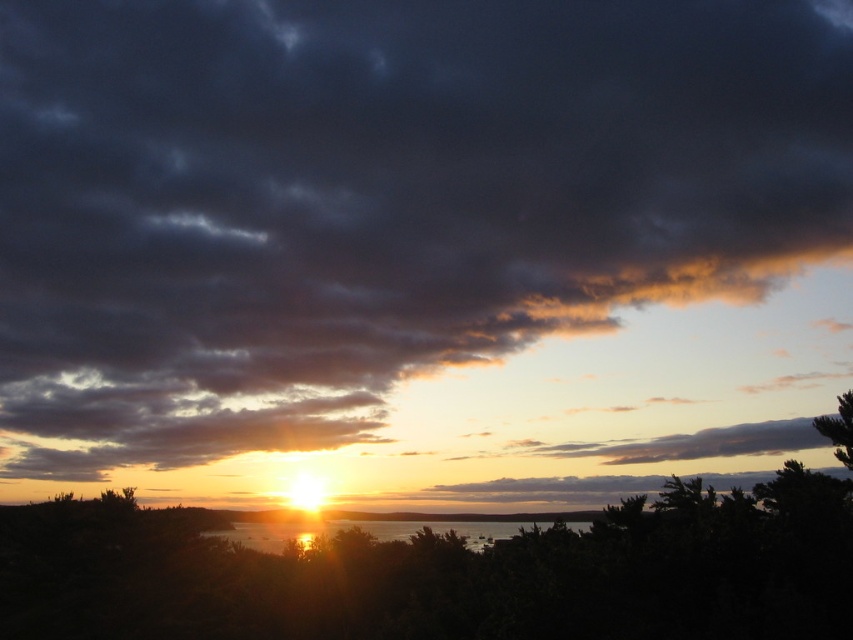
You are standing at the edge of the water in the sunset scene. There are two points marked in the image, point 1 at coordinates point (267, 525) and point 2 at coordinates point (850, 397). Which point is closer to you?

Point (267, 525) is closer to you because it is further to the viewer than point (850, 397).

You are standing on a pier and want to reach the shiny reflective water at center to retrieve a floating item. Given that the pier extends 40 feet from the shore, can you safely reach the water without stepping off the pier?

The shiny reflective water at center is 43.91 feet from the viewer. Since the pier only extends 40 feet from the shore, you cannot safely reach the water without stepping off the pier.

You are standing at the edge of the water and want to take a photo of the sunset. The green leafy tree at lower right is blocking your view. To get a clear shot, should you move to the left or right of the shiny reflective water at center?

The shiny reflective water at center is to the left of the green leafy tree at lower right. To avoid the tree blocking the view, you should move to the right of the shiny reflective water at center.